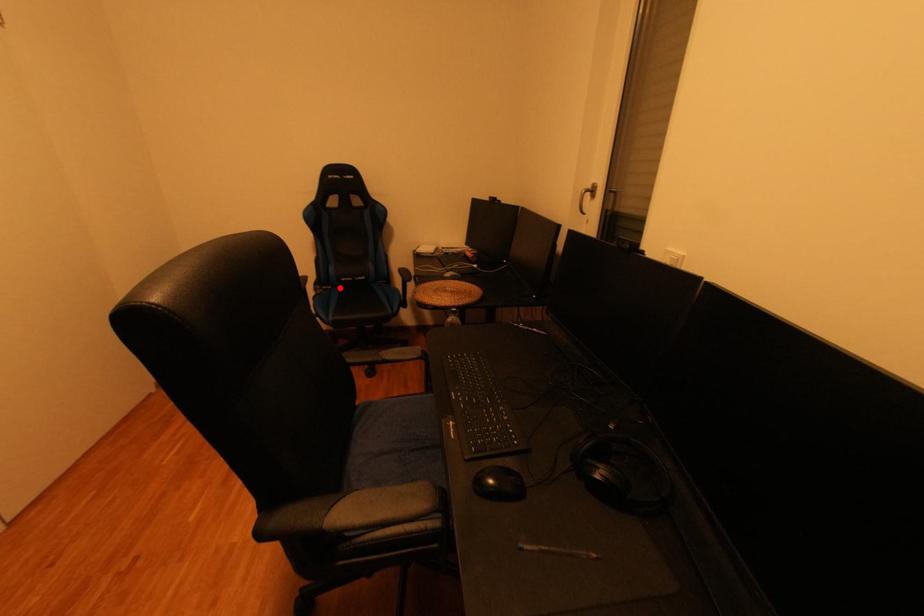
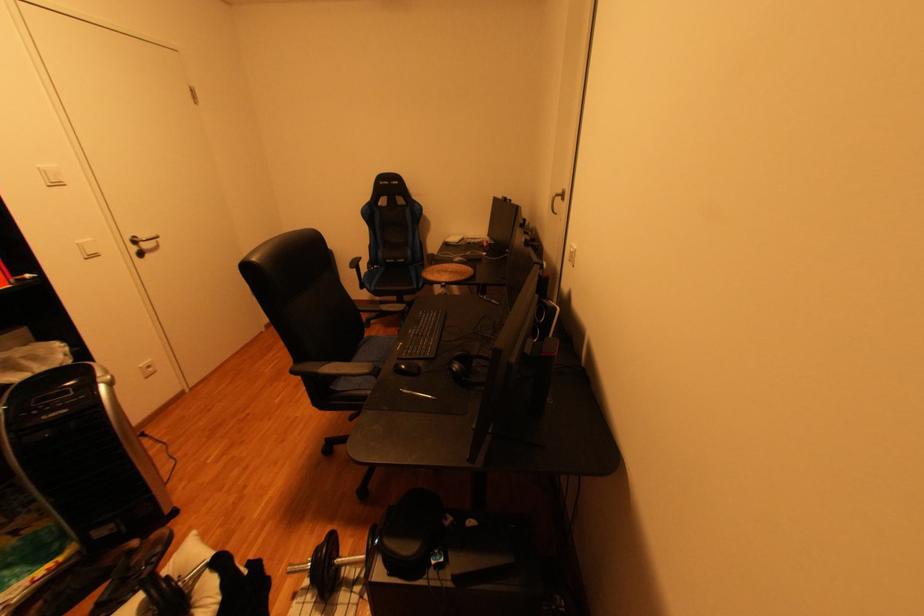
Find the pixel in the second image that matches the highlighted location in the first image.

(390, 267)